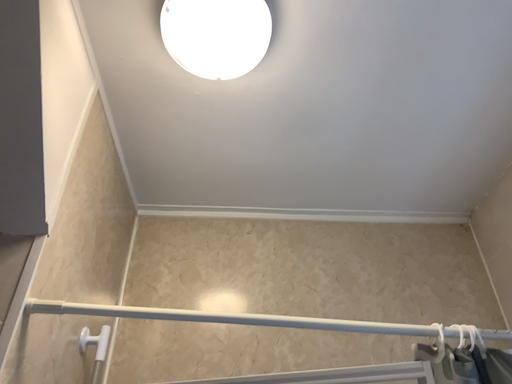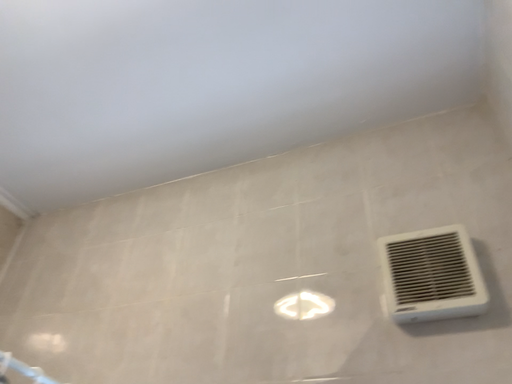
Question: How did the camera likely rotate when shooting the video?

Choices:
 (A) rotated left
 (B) rotated right

Answer: (B)